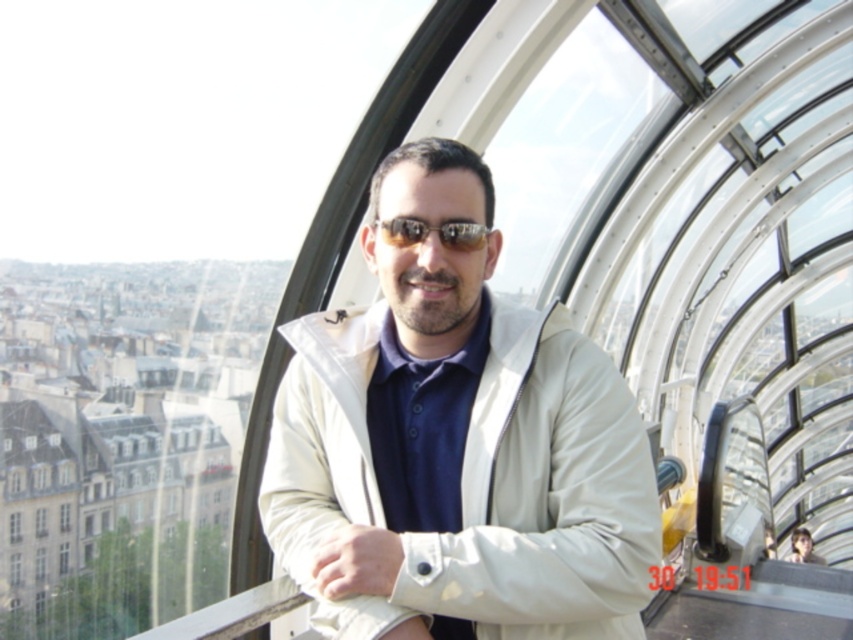
Question: Is beige fabric jacket at center wider than sunglasses at center?

Choices:
 (A) no
 (B) yes

Answer: (B)

Question: Which object is closer to the camera taking this photo?

Choices:
 (A) beige fabric jacket at center
 (B) sunglasses at center
 (C) matte beige jacket at center

Answer: (A)

Question: Does beige fabric jacket at center come behind sunglasses at center?

Choices:
 (A) no
 (B) yes

Answer: (A)

Question: Which of the following is the closest to the observer?

Choices:
 (A) (817, 561)
 (B) (389, 452)

Answer: (B)

Question: Which object appears farthest from the camera in this image?

Choices:
 (A) sunglasses at center
 (B) matte beige jacket at center
 (C) beige fabric jacket at center

Answer: (B)

Question: Is beige fabric jacket at center above sunglasses at center?

Choices:
 (A) no
 (B) yes

Answer: (A)